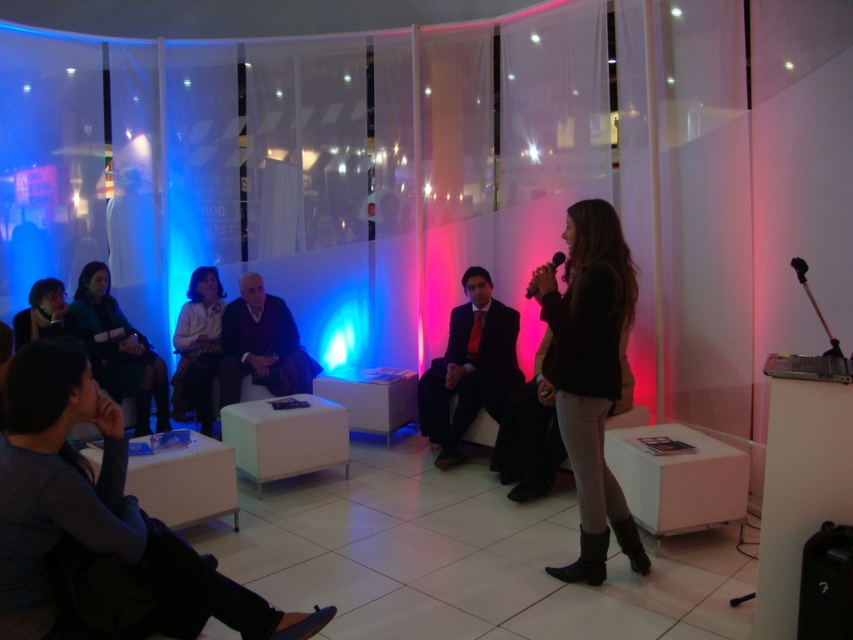
You are organizing a fashion show and need to arrange two jackets on a mannequin stand. The stand has two hooks positioned side by side. The black leather jacket at center and the matte green jacket at center must be placed according to their positions in the image. Which jacket should go on the left hook?

The matte green jacket at center should be placed on the left hook because the black leather jacket at center is positioned to its right in the image.

Where is the matte green jacket at center located in the image?

The matte green jacket at center is located at point (119, 348) in the image.

You are standing in the conference room and see the curved wall with translucent panels. You want to place a new decorative item exactly at the point marked by the coordinates point (x=590, y=376). What object is currently located at that position?

The point (x=590, y=376) indicates the location of the black leather jacket at center, so placing the new decorative item there would require moving the existing black leather jacket at center.